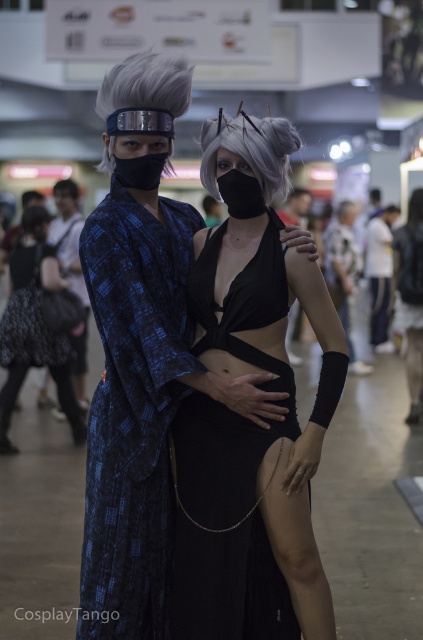
Question: In this image, where is black matte dress at center located relative to sleek silver wig at center?

Choices:
 (A) above
 (B) below

Answer: (B)

Question: Which object appears farthest from the camera in this image?

Choices:
 (A) matte black bikini top at center
 (B) black matte dress at center
 (C) blue patterned kimono at center

Answer: (A)

Question: Is sleek silver wig at center above sleek silver wig at upper center?

Choices:
 (A) yes
 (B) no

Answer: (B)

Question: Does sleek silver wig at upper center have a larger size compared to matte blue kimono at left?

Choices:
 (A) yes
 (B) no

Answer: (B)

Question: Which object is positioned farthest from the blue patterned kimono at center?

Choices:
 (A) matte black kimono at center
 (B) sleek silver wig at upper center
 (C) matte blue kimono at left

Answer: (A)

Question: Among these objects, which one is nearest to the camera?

Choices:
 (A) blue patterned kimono at center
 (B) black matte dress at center
 (C) matte black kimono at center
 (D) sleek silver wig at upper center

Answer: (A)